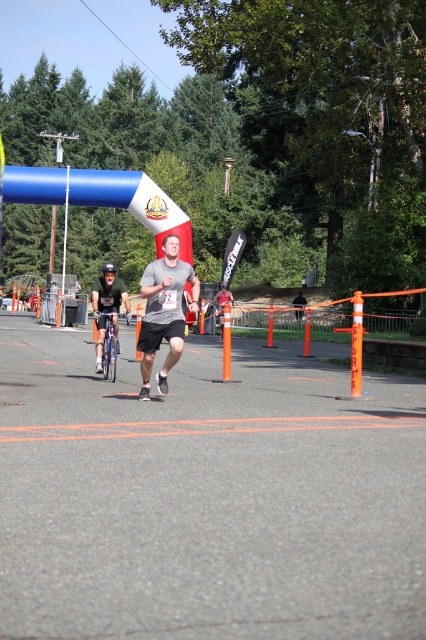
You are standing at the starting line of the race and want to know which of the two points, point (178, 349) or point (103, 280), is closer to you. Can you determine this based on the image?

Point (178, 349) is closer to the viewer than point (103, 280), so yes, you can determine that point (178, 349) is closer to you.

You are a photographer at the finish line. You need to capture a photo where both the gray matte shirt at center and the green matte shirt at center are visible. Which shirt should you focus on to ensure both are in frame?

The gray matte shirt at center is taller than the green matte shirt at center, so focusing on the taller gray matte shirt at center will ensure both are in frame.

What object is located at the coordinates point [164,310]?

The gray matte shirt at center is located at point [164,310].